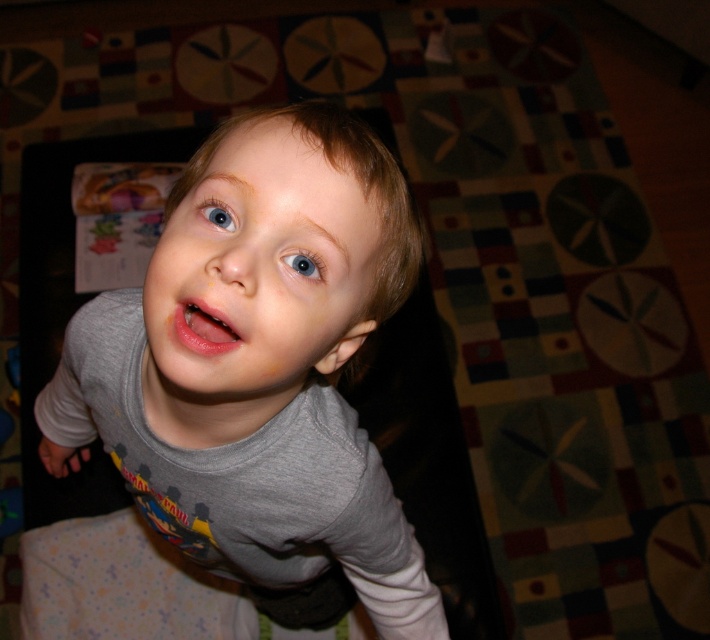
Question: Can you confirm if gray matte shirt at center is bigger than smooth gray shirt at center?

Choices:
 (A) no
 (B) yes

Answer: (B)

Question: Which point is farther from the camera taking this photo?

Choices:
 (A) (293, 252)
 (B) (359, 298)

Answer: (B)

Question: Is pink matte lips at center above blue matte eye at upper center?

Choices:
 (A) no
 (B) yes

Answer: (A)

Question: Estimate the real-world distances between objects in this image. Which object is closer to the gray matte shirt at center?

Choices:
 (A) smooth gray shirt at center
 (B) blue glossy eye at upper center
 (C) pink matte lips at center

Answer: (A)

Question: Where is gray matte shirt at center located in relation to blue glossy eye at upper center in the image?

Choices:
 (A) left
 (B) right

Answer: (A)

Question: Estimate the real-world distances between objects in this image. Which object is closer to the smooth gray shirt at center?

Choices:
 (A) gray matte shirt at center
 (B) blue matte eye at upper center

Answer: (B)